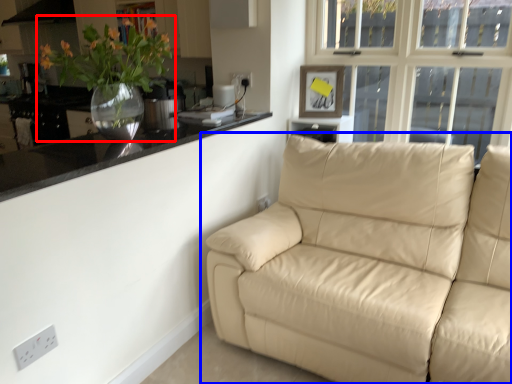
Question: Which object is closer to the camera taking this photo, houseplant (highlighted by a red box) or studio couch (highlighted by a blue box)?

Choices:
 (A) houseplant
 (B) studio couch

Answer: (B)